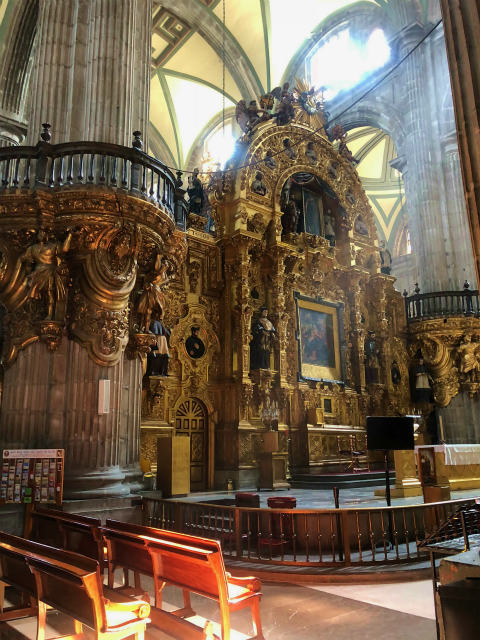
Image resolution: width=480 pixels, height=640 pixels. What are the coordinates of `window` in the screenshot? It's located at (200, 111), (359, 50).